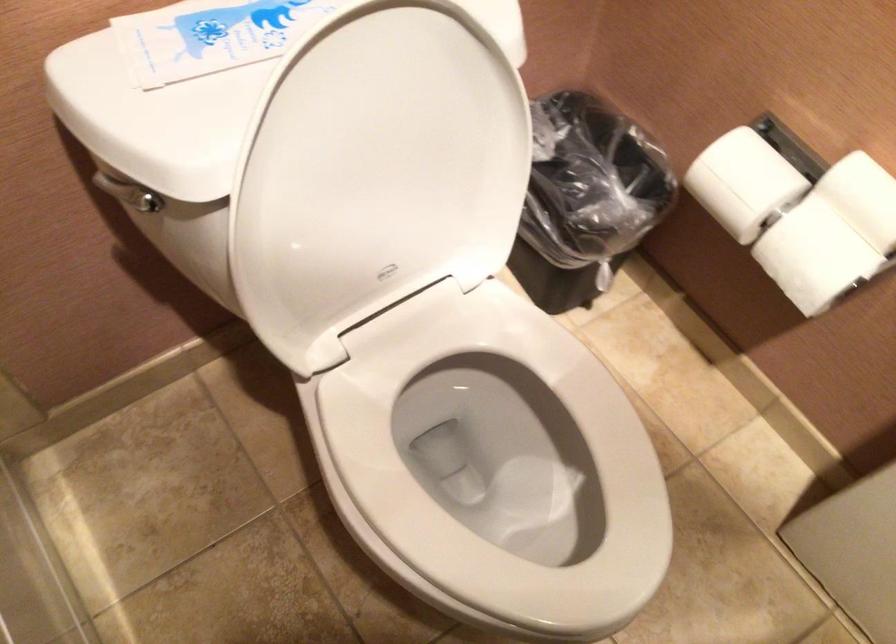
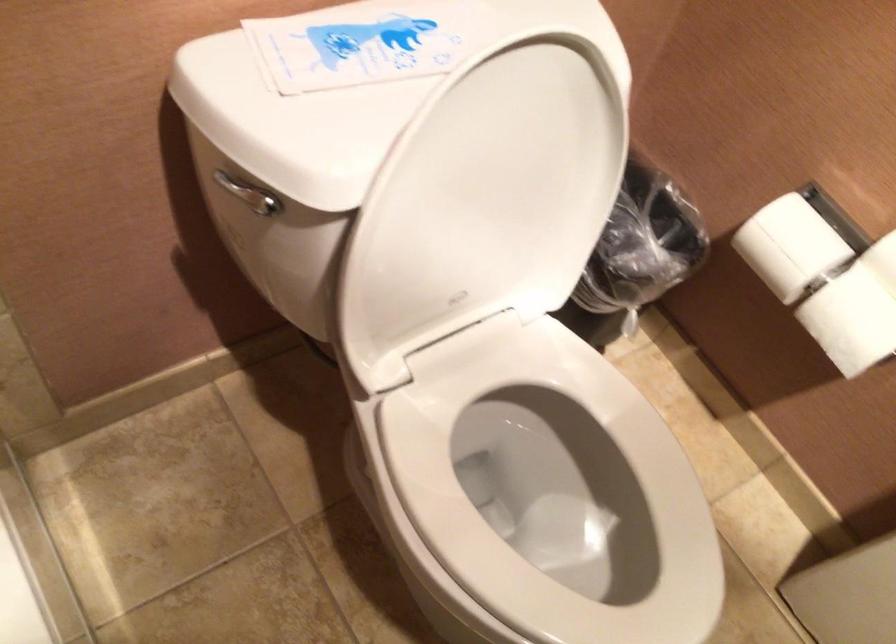
Question: The images are taken continuously from a first-person perspective. In which direction are you moving?

Choices:
 (A) Left
 (B) Right
 (C) Forward
 (D) Backward

Answer: (A)